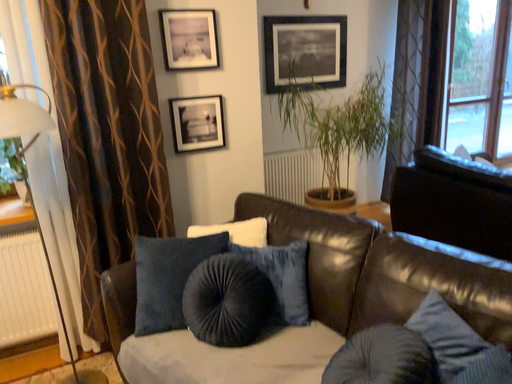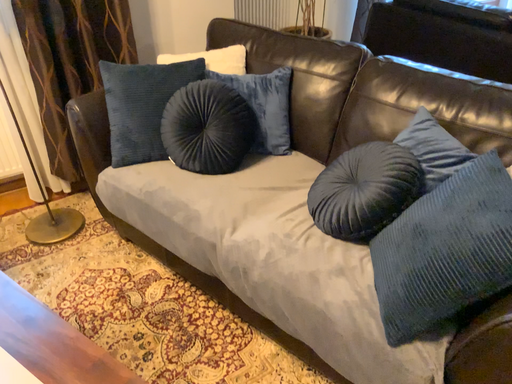
Question: How did the camera likely rotate when shooting the video?

Choices:
 (A) rotated downward
 (B) rotated upward

Answer: (A)